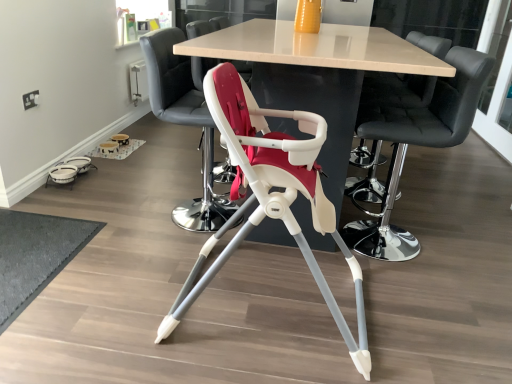
The image size is (512, 384). I want to click on free spot to the right of matte white highchair at center, which appears as the 2th chair when viewed from the left, so click(425, 315).